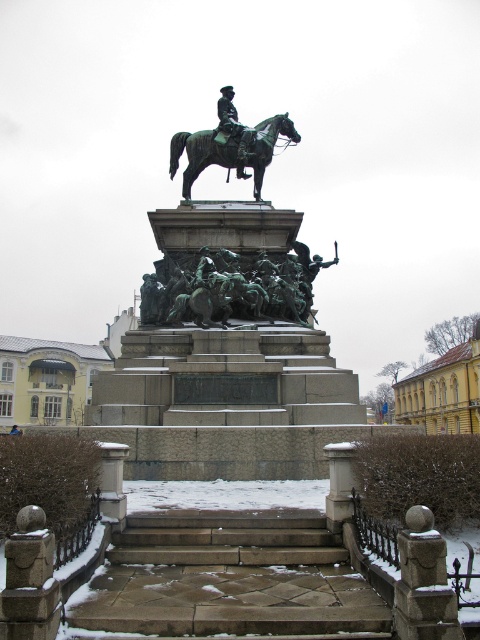
Question: Which point is closer to the camera?

Choices:
 (A) click(x=247, y=232)
 (B) click(x=253, y=188)

Answer: (A)

Question: Which point is closer to the camera?

Choices:
 (A) (228, 122)
 (B) (180, 132)
 (C) (191, 205)

Answer: (C)

Question: Is green polished metal statue at center above bronze/greenish metal horse at center?

Choices:
 (A) no
 (B) yes

Answer: (A)

Question: Is green polished metal statue at center above bronze statue at upper center?

Choices:
 (A) no
 (B) yes

Answer: (A)

Question: Can you confirm if bronze/greenish metal horse at center is positioned above bronze statue at upper center?

Choices:
 (A) yes
 (B) no

Answer: (B)

Question: Which of the following is the closest to the observer?

Choices:
 (A) (240, 173)
 (B) (294, 250)
 (C) (214, 387)

Answer: (C)